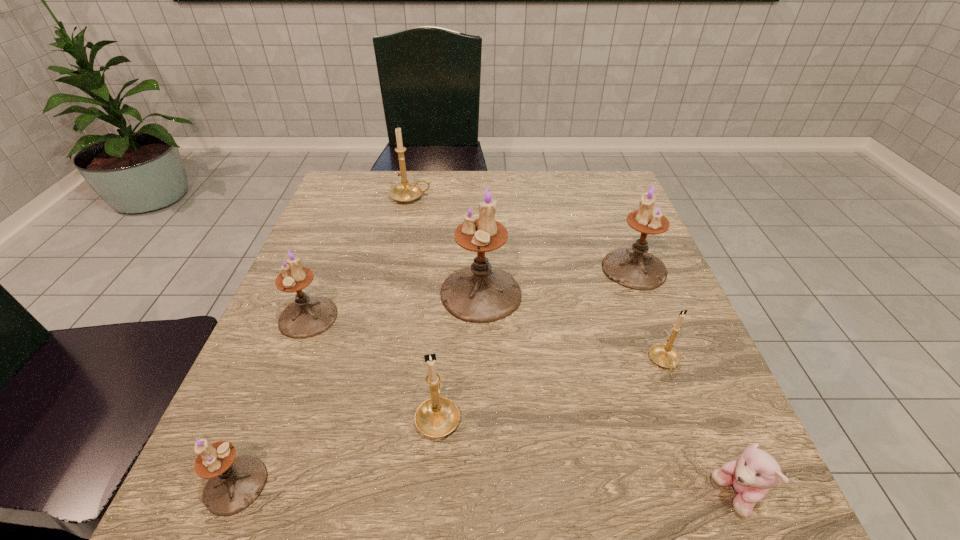
Find the location of a particular element. The image size is (960, 540). object at the far left corner is located at coordinates (405, 192).

The height and width of the screenshot is (540, 960). Find the location of `object that is positioned at the near left corner`. object that is positioned at the near left corner is located at coordinates (234, 483).

Where is `object located in the near right corner section of the desktop`? object located in the near right corner section of the desktop is located at coordinates (751, 476).

Where is `vacant space at the far edge of the desktop`? The width and height of the screenshot is (960, 540). vacant space at the far edge of the desktop is located at coordinates (564, 180).

In the image, there is a desktop. Identify the location of vacant space at the left edge. (276, 313).

Find the location of a particular element. The image size is (960, 540). free region at the right edge of the desktop is located at coordinates (646, 371).

What are the coordinates of `free space at the far left corner` in the screenshot? It's located at (360, 196).

You are a GUI agent. You are given a task and a screenshot of the screen. Output one action in this format:
    pyautogui.click(x=<x>, y=<y>)
    Task: Click on the empty space between the third candle holder from left to right and the smallest gold candle holder
    The width and height of the screenshot is (960, 540).
    Given the screenshot: What is the action you would take?
    pyautogui.click(x=538, y=280)

I want to click on free space that is in between the second smallest purple candle holder and the pink teddy bear, so click(x=522, y=407).

Image resolution: width=960 pixels, height=540 pixels. I want to click on free space that is in between the teddy bear and the second farthest gold candle holder, so click(x=701, y=429).